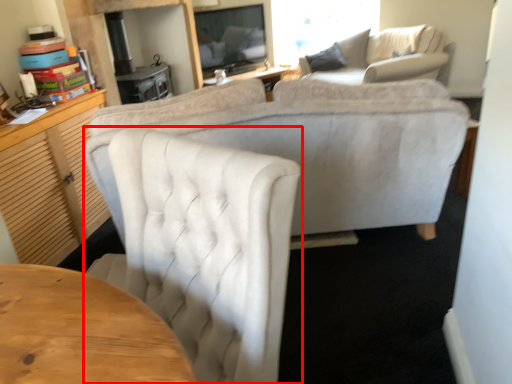
Question: From the image's perspective, considering the relative positions of chair (annotated by the red box) and studio couch in the image provided, where is chair (annotated by the red box) located with respect to the staircase?

Choices:
 (A) above
 (B) below

Answer: (B)